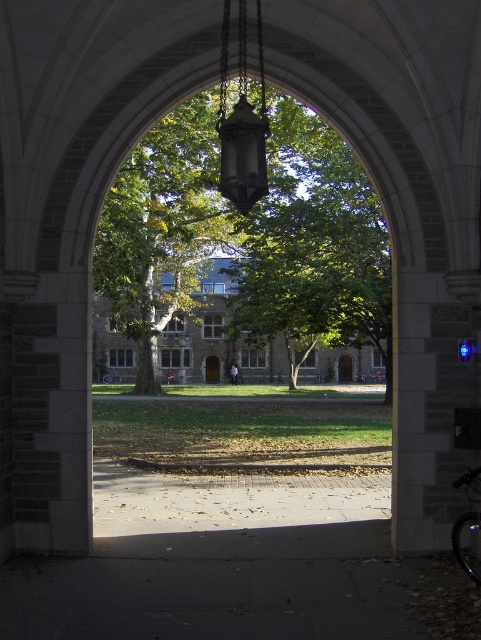
You are standing outside the arched stone gateway and want to place a small bench between the green leafy tree at center and the matte black lantern at center. Is the space between them wide enough for a bench that is 1.2 meters long?

The green leafy tree at center is located below the matte black lantern at center, so the vertical distance between them is not suitable for placing a bench horizontally. The bench should be placed on the ground near the tree instead.

You are standing at the entrance of the arched stone gateway and want to walk straight ahead towards the courtyard. There is a green leafy tree at center in your path. Based on its position, will you need to adjust your path to avoid it?

The green leafy tree at center is located at coordinates point (248,237), which means it is positioned slightly to the left of the center point of the image. Therefore, you would need to adjust your path slightly to the right to avoid walking into the tree.

You are standing in front of the arched stone gateway and see two points marked in the scene. Which point is closer to you, point (309, 310) or point (219, 97)?

Point (219, 97) is closer to you because it is less further to the viewer than point (309, 310).